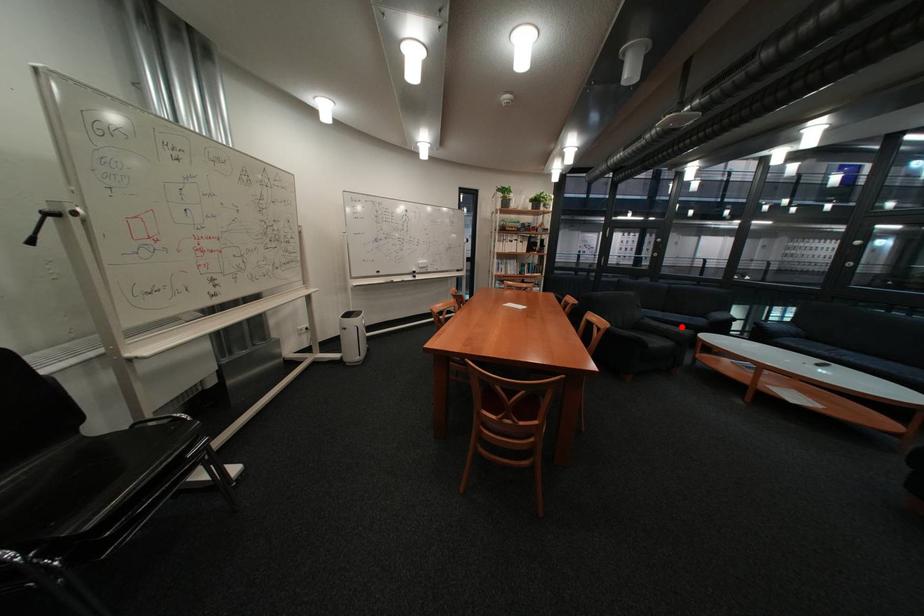
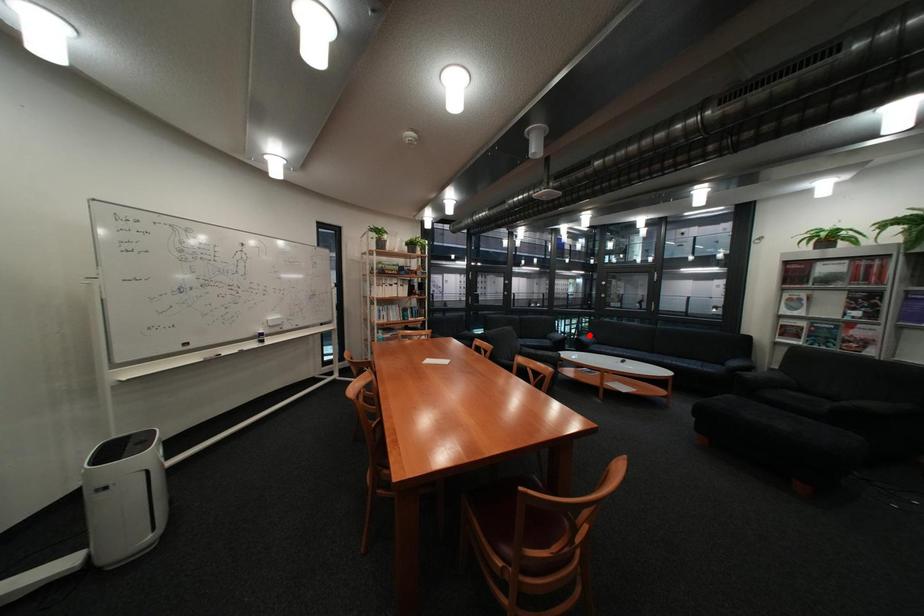
I am providing you with two images of the same scene from different viewpoints. A red point is marked on the first image and another point is marked on the second image. Are the points marked in image1 and image2 representing the same 3D position?

No